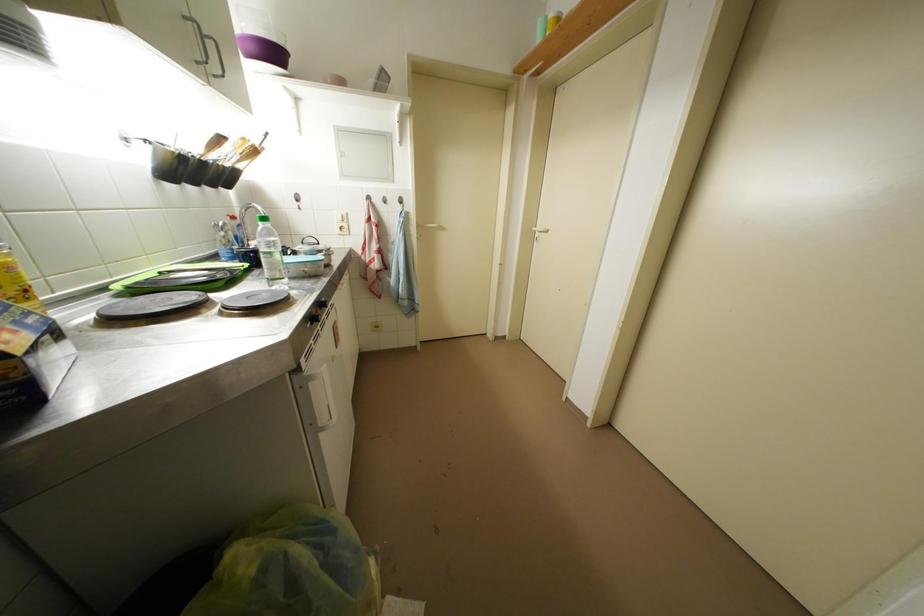
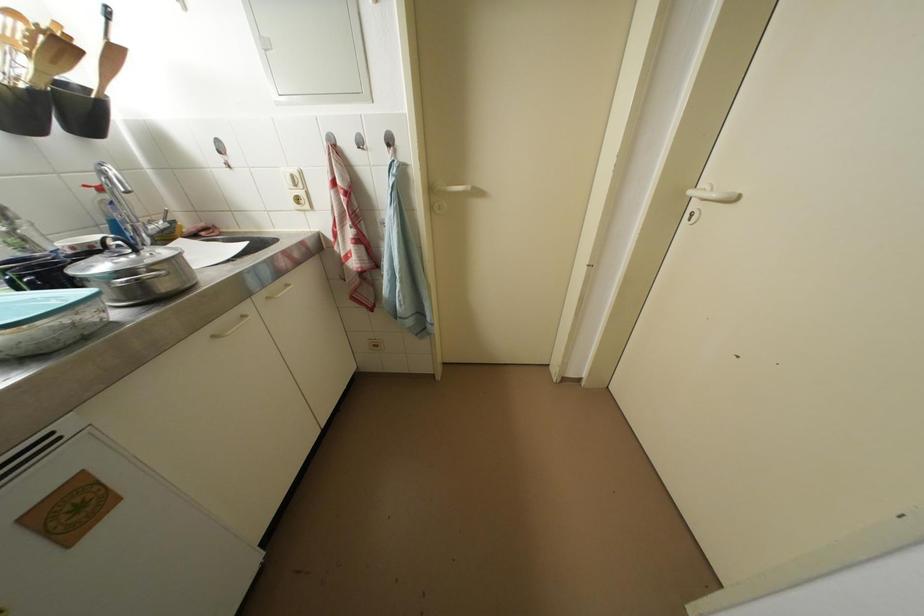
In the second image, find the point that corresponds to pixel 541 233 in the first image.

(698, 197)